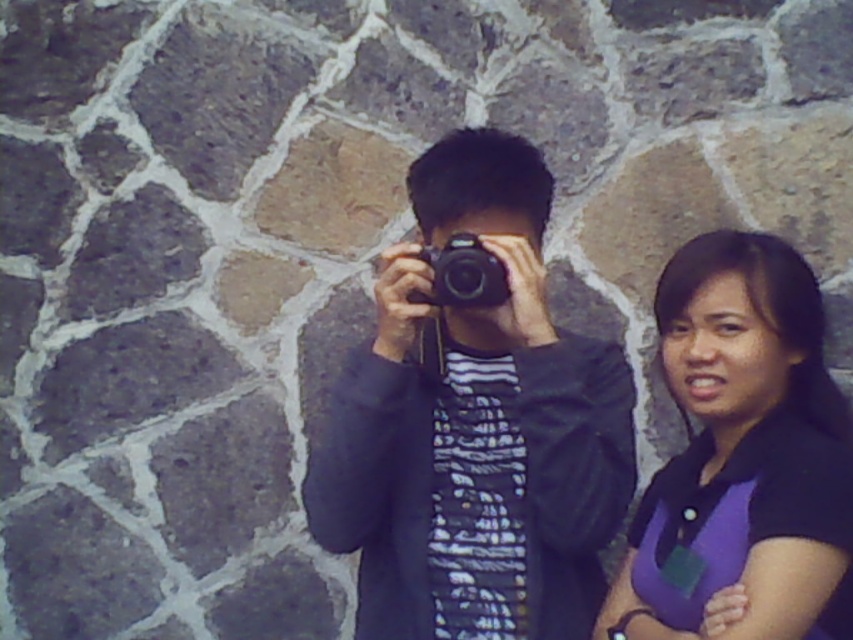
In the scene shown: You are a photographer trying to capture the purple matte shirt at right and the black plastic camera at center in a single frame. Which object should you focus on first if you want to ensure both are in focus, considering their sizes?

The purple matte shirt at right has a larger size compared to the black plastic camera at center, so you should focus on the larger object first to ensure both are in focus.